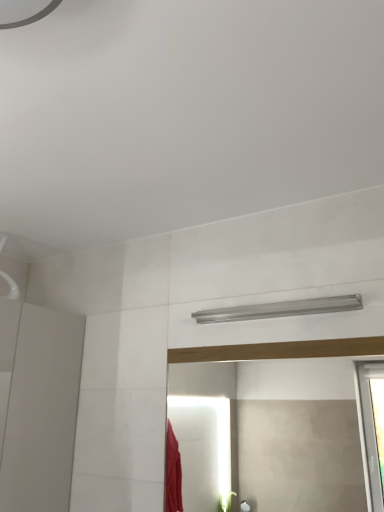
Question: Is silver metallic shower at upper center completely or partially inside matte wooden mirror at center?

Choices:
 (A) yes
 (B) no

Answer: (B)

Question: Does matte wooden mirror at center have a lesser width compared to silver metallic shower at upper center?

Choices:
 (A) no
 (B) yes

Answer: (B)

Question: From the image's perspective, is matte wooden mirror at center located beneath silver metallic shower at upper center?

Choices:
 (A) yes
 (B) no

Answer: (A)

Question: Is matte wooden mirror at center further to camera compared to silver metallic shower at upper center?

Choices:
 (A) no
 (B) yes

Answer: (A)

Question: From a real-world perspective, does matte wooden mirror at center sit lower than silver metallic shower at upper center?

Choices:
 (A) no
 (B) yes

Answer: (B)

Question: Can you confirm if matte wooden mirror at center is positioned to the left of silver metallic shower at upper center?

Choices:
 (A) yes
 (B) no

Answer: (A)

Question: Is silver metallic shower at upper center bigger than matte wooden mirror at center?

Choices:
 (A) no
 (B) yes

Answer: (A)

Question: Is silver metallic shower at upper center smaller than matte wooden mirror at center?

Choices:
 (A) yes
 (B) no

Answer: (A)

Question: Is silver metallic shower at upper center further to camera compared to matte wooden mirror at center?

Choices:
 (A) no
 (B) yes

Answer: (B)

Question: Is silver metallic shower at upper center oriented towards matte wooden mirror at center?

Choices:
 (A) no
 (B) yes

Answer: (A)

Question: Is silver metallic shower at upper center to the left of matte wooden mirror at center from the viewer's perspective?

Choices:
 (A) no
 (B) yes

Answer: (A)

Question: Can you confirm if silver metallic shower at upper center is positioned to the right of matte wooden mirror at center?

Choices:
 (A) no
 (B) yes

Answer: (B)

Question: Relative to silver metallic shower at upper center, is matte wooden mirror at center in front or behind?

Choices:
 (A) front
 (B) behind

Answer: (A)